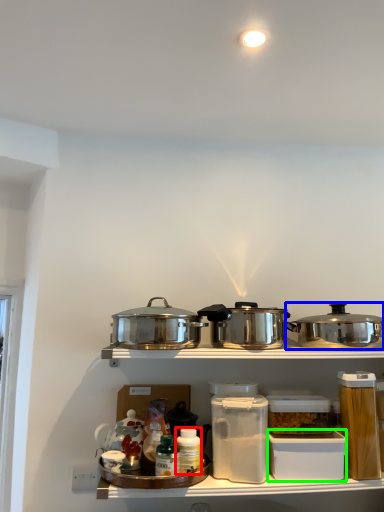
Question: Which object is the farthest from bottle (highlighted by a red box)? Choose among these: kitchen appliance (highlighted by a blue box) or box (highlighted by a green box).

Choices:
 (A) kitchen appliance
 (B) box

Answer: (A)